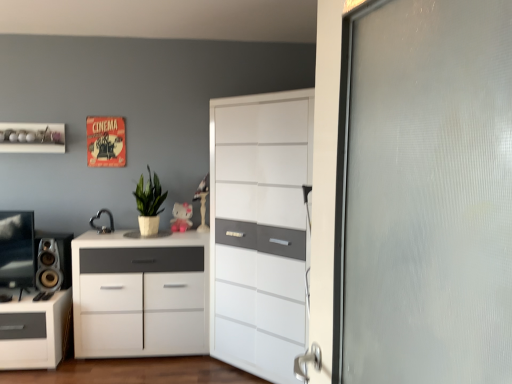
Question: Is matte pink plastic toy at center facing towards white glossy cabinet at center, which is counted as the 1th chest of drawers, starting from the right?

Choices:
 (A) no
 (B) yes

Answer: (A)

Question: Is matte pink plastic toy at center smaller than white glossy cabinet at center, the second chest of drawers positioned from the left?

Choices:
 (A) no
 (B) yes

Answer: (B)

Question: Is matte pink plastic toy at center far from white glossy cabinet at center, the second chest of drawers positioned from the left?

Choices:
 (A) no
 (B) yes

Answer: (A)

Question: From the image's perspective, is matte pink plastic toy at center on top of white glossy cabinet at center, which is counted as the 1th chest of drawers, starting from the right?

Choices:
 (A) no
 (B) yes

Answer: (B)

Question: Is matte pink plastic toy at center outside white glossy cabinet at center, the second chest of drawers positioned from the left?

Choices:
 (A) yes
 (B) no

Answer: (A)

Question: Considering the positions of white matte cabinet at center, the first chest of drawers when ordered from left to right, and green matte plant at center in the image, is white matte cabinet at center, the first chest of drawers when ordered from left to right, wider or thinner than green matte plant at center?

Choices:
 (A) thin
 (B) wide

Answer: (B)

Question: Choose the correct answer: Is white matte cabinet at center, the 2th chest of drawers viewed from the right, inside green matte plant at center or outside it?

Choices:
 (A) inside
 (B) outside

Answer: (B)

Question: From the image's perspective, is white matte cabinet at center, the 2th chest of drawers viewed from the right, positioned above or below green matte plant at center?

Choices:
 (A) above
 (B) below

Answer: (B)

Question: Considering the positions of white matte cabinet at center, the 2th chest of drawers viewed from the right, and green matte plant at center in the image, is white matte cabinet at center, the 2th chest of drawers viewed from the right, bigger or smaller than green matte plant at center?

Choices:
 (A) big
 (B) small

Answer: (A)

Question: Based on their sizes in the image, would you say matte pink plastic toy at center is bigger or smaller than green matte plant at center?

Choices:
 (A) big
 (B) small

Answer: (B)

Question: In the image, is matte pink plastic toy at center on the left side or the right side of green matte plant at center?

Choices:
 (A) right
 (B) left

Answer: (A)

Question: From the image's perspective, is matte pink plastic toy at center above or below green matte plant at center?

Choices:
 (A) above
 (B) below

Answer: (B)

Question: Is point (179, 206) closer or farther from the camera than point (148, 200)?

Choices:
 (A) closer
 (B) farther

Answer: (B)

Question: Is white glossy shelf at upper left wider or thinner than green matte plant at center?

Choices:
 (A) wide
 (B) thin

Answer: (B)

Question: Is point (24, 152) positioned closer to the camera than point (162, 193)?

Choices:
 (A) closer
 (B) farther

Answer: (A)